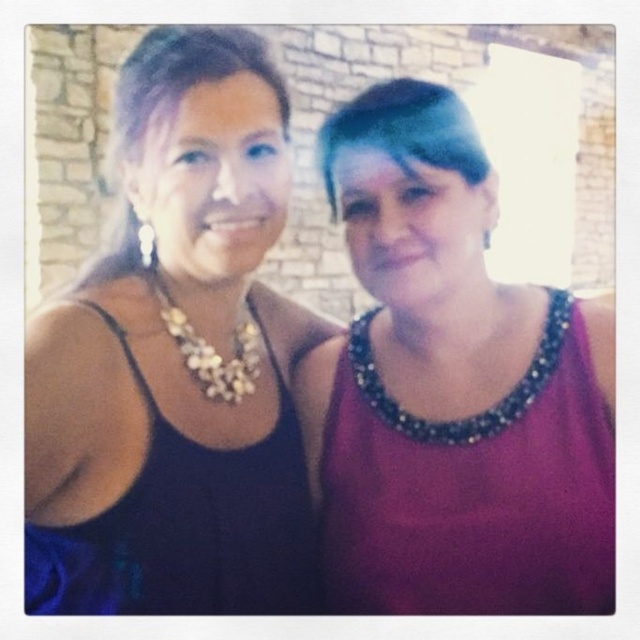
What do you see at coordinates (212, 352) in the screenshot? I see `pearl and glass necklace at center` at bounding box center [212, 352].

Locate an element on the screen. This screenshot has width=640, height=640. pearl and glass necklace at center is located at coordinates (212, 352).

Can you confirm if purple beaded tank top at right is smaller than pearl and glass necklace at center?

Incorrect, purple beaded tank top at right is not smaller in size than pearl and glass necklace at center.

Is purple beaded tank top at right bigger than pearl and glass necklace at center?

Yes.

Is point (508, 525) closer to camera compared to point (168, 304)?

That is True.

Image resolution: width=640 pixels, height=640 pixels. Identify the location of purple beaded tank top at right. (472, 490).

Is purple beaded tank top at right bigger than dark blue satin dress at left?

Indeed, purple beaded tank top at right has a larger size compared to dark blue satin dress at left.

Is purple beaded tank top at right taller than dark blue satin dress at left?

Correct, purple beaded tank top at right is much taller as dark blue satin dress at left.

Find the location of a particular element. purple beaded tank top at right is located at coordinates (472, 490).